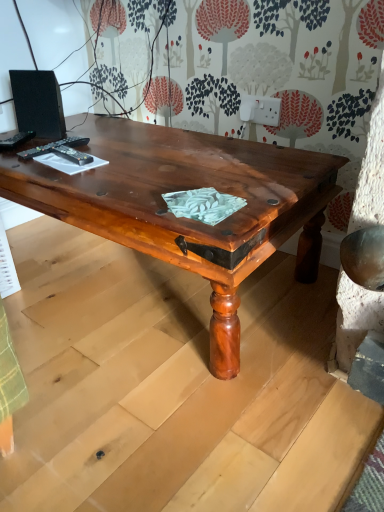
What is the approximate width of black plastic remote control at upper left, which ranks as the 2th remote control in left-to-right order?

It is 9.00 inches.

This screenshot has width=384, height=512. Find the location of `black matte speaker at upper left`. black matte speaker at upper left is located at coordinates (38, 103).

Identify the location of black plastic remote control at upper left, positioned as the 1th remote control in right-to-left order. Image resolution: width=384 pixels, height=512 pixels. (72, 155).

Is black plastic remote control at upper left, the first remote control in the left-to-right sequence, positioned beyond the bounds of black plastic remote control at upper left, the 3th remote control viewed from the left?

Yes, black plastic remote control at upper left, the first remote control in the left-to-right sequence, is located beyond the bounds of black plastic remote control at upper left, the 3th remote control viewed from the left.

Does black plastic remote control at upper left, acting as the third remote control starting from the right, come behind black plastic remote control at upper left, positioned as the 1th remote control in right-to-left order?

Yes, black plastic remote control at upper left, acting as the third remote control starting from the right, is behind black plastic remote control at upper left, positioned as the 1th remote control in right-to-left order.

Who is smaller, black plastic remote control at upper left, the first remote control in the left-to-right sequence, or black plastic remote control at upper left, the 3th remote control viewed from the left?

Smaller between the two is black plastic remote control at upper left, the first remote control in the left-to-right sequence.

From the image's perspective, is black plastic remote control at upper left, the first remote control in the left-to-right sequence, located above or below black plastic remote control at upper left, positioned as the 1th remote control in right-to-left order?

Based on their image positions, black plastic remote control at upper left, the first remote control in the left-to-right sequence, is located above black plastic remote control at upper left, positioned as the 1th remote control in right-to-left order.

Who is bigger, shiny brown wood coffee table at center or black plastic remote control at upper left, positioned as the 1th remote control in right-to-left order?

shiny brown wood coffee table at center.

Is shiny brown wood coffee table at center next to black plastic remote control at upper left, positioned as the 1th remote control in right-to-left order?

No, shiny brown wood coffee table at center is not with black plastic remote control at upper left, positioned as the 1th remote control in right-to-left order.

How many degrees apart are the facing directions of shiny brown wood coffee table at center and black plastic remote control at upper left, the 3th remote control viewed from the left?

shiny brown wood coffee table at center and black plastic remote control at upper left, the 3th remote control viewed from the left, are facing 80.2 degrees away from each other.

Locate an element on the screen. This screenshot has height=512, width=384. coffee table on the right side of black plastic remote control at upper left, the 3th remote control viewed from the left is located at coordinates (185, 218).

Are black matte speaker at upper left and black plastic remote control at upper left, the 3th remote control viewed from the left, beside each other?

black matte speaker at upper left is not next to black plastic remote control at upper left, the 3th remote control viewed from the left, and they're not touching.

Considering the positions of objects black matte speaker at upper left and black plastic remote control at upper left, positioned as the 1th remote control in right-to-left order, in the image provided, who is behind, black matte speaker at upper left or black plastic remote control at upper left, positioned as the 1th remote control in right-to-left order,?

black matte speaker at upper left.

Is black matte speaker at upper left at the right side of black plastic remote control at upper left, positioned as the 1th remote control in right-to-left order?

No.

Does point (63, 133) lie in front of point (85, 163)?

No, (63, 133) is further to viewer.

From the picture: Between black plastic remote control at upper left, the first remote control in the left-to-right sequence, and black plastic remote control at upper left, which ranks as the 2th remote control in left-to-right order, which one appears on the left side from the viewer's perspective?

black plastic remote control at upper left, the first remote control in the left-to-right sequence.

Does black plastic remote control at upper left, acting as the third remote control starting from the right, have a smaller size compared to black plastic remote control at upper left, the second remote control in the right-to-left sequence?

Yes.

In the scene shown: Could you tell me if black plastic remote control at upper left, the first remote control in the left-to-right sequence, is turned towards black plastic remote control at upper left, which ranks as the 2th remote control in left-to-right order?

No, black plastic remote control at upper left, the first remote control in the left-to-right sequence, is not oriented towards black plastic remote control at upper left, which ranks as the 2th remote control in left-to-right order.

Is black plastic remote control at upper left, the first remote control in the left-to-right sequence, not near black plastic remote control at upper left, which ranks as the 2th remote control in left-to-right order?

No, black plastic remote control at upper left, the first remote control in the left-to-right sequence, is not far away from black plastic remote control at upper left, which ranks as the 2th remote control in left-to-right order.

How many degrees apart are the facing directions of black plastic remote control at upper left, the second remote control in the right-to-left sequence, and black plastic remote control at upper left, the 3th remote control viewed from the left?

88.8 degrees separate the facing orientations of black plastic remote control at upper left, the second remote control in the right-to-left sequence, and black plastic remote control at upper left, the 3th remote control viewed from the left.

Is black plastic remote control at upper left, which ranks as the 2th remote control in left-to-right order, touching black plastic remote control at upper left, positioned as the 1th remote control in right-to-left order?

Indeed, black plastic remote control at upper left, which ranks as the 2th remote control in left-to-right order, and black plastic remote control at upper left, positioned as the 1th remote control in right-to-left order, are beside each other and touching.

Does black plastic remote control at upper left, the second remote control in the right-to-left sequence, appear on the left side of black plastic remote control at upper left, positioned as the 1th remote control in right-to-left order?

Indeed, black plastic remote control at upper left, the second remote control in the right-to-left sequence, is positioned on the left side of black plastic remote control at upper left, positioned as the 1th remote control in right-to-left order.

Is black plastic remote control at upper left, which ranks as the 2th remote control in left-to-right order, wider than black plastic remote control at upper left, positioned as the 1th remote control in right-to-left order?

Indeed, black plastic remote control at upper left, which ranks as the 2th remote control in left-to-right order, has a greater width compared to black plastic remote control at upper left, positioned as the 1th remote control in right-to-left order.

Does black plastic remote control at upper left, positioned as the 1th remote control in right-to-left order, have a larger size compared to shiny brown wood coffee table at center?

No.

From a real-world perspective, which is physically above, black plastic remote control at upper left, the 3th remote control viewed from the left, or shiny brown wood coffee table at center?

black plastic remote control at upper left, the 3th remote control viewed from the left, is physically above.

How different are the orientations of black plastic remote control at upper left, the 3th remote control viewed from the left, and shiny brown wood coffee table at center in degrees?

black plastic remote control at upper left, the 3th remote control viewed from the left, and shiny brown wood coffee table at center are facing 80.2 degrees away from each other.

Are black plastic remote control at upper left, positioned as the 1th remote control in right-to-left order, and shiny brown wood coffee table at center making contact?

No, black plastic remote control at upper left, positioned as the 1th remote control in right-to-left order, is not in contact with shiny brown wood coffee table at center.

Does black plastic remote control at upper left, which ranks as the 2th remote control in left-to-right order, turn towards black plastic remote control at upper left, acting as the third remote control starting from the right?

No.

What's the angular difference between black plastic remote control at upper left, which ranks as the 2th remote control in left-to-right order, and black plastic remote control at upper left, acting as the third remote control starting from the right,'s facing directions?

The facing directions of black plastic remote control at upper left, which ranks as the 2th remote control in left-to-right order, and black plastic remote control at upper left, acting as the third remote control starting from the right, are 36.6 degrees apart.

Considering the relative sizes of black plastic remote control at upper left, which ranks as the 2th remote control in left-to-right order, and black plastic remote control at upper left, the first remote control in the left-to-right sequence, in the image provided, is black plastic remote control at upper left, which ranks as the 2th remote control in left-to-right order, taller than black plastic remote control at upper left, the first remote control in the left-to-right sequence,?

Yes, black plastic remote control at upper left, which ranks as the 2th remote control in left-to-right order, is taller than black plastic remote control at upper left, the first remote control in the left-to-right sequence.

Identify the location of remote control located above the black plastic remote control at upper left, which ranks as the 2th remote control in left-to-right order (from the image's perspective). This screenshot has height=512, width=384. (16, 140).

Locate an element on the screen. This screenshot has width=384, height=512. the 2nd remote control to the left of the black plastic remote control at upper left, positioned as the 1th remote control in right-to-left order, counting from the anchor's position is located at coordinates (16, 140).

Where is `the 1st remote control above when counting from the shiny brown wood coffee table at center (from the image's perspective)`? the 1st remote control above when counting from the shiny brown wood coffee table at center (from the image's perspective) is located at coordinates (72, 155).

Based on their spatial positions, is black plastic remote control at upper left, the 3th remote control viewed from the left, or black plastic remote control at upper left, the first remote control in the left-to-right sequence, closer to shiny brown wood coffee table at center?

black plastic remote control at upper left, the 3th remote control viewed from the left, lies closer to shiny brown wood coffee table at center than the other object.

Considering their positions, is black matte speaker at upper left positioned further to black plastic remote control at upper left, acting as the third remote control starting from the right, than black plastic remote control at upper left, the 3th remote control viewed from the left?

Based on the image, black plastic remote control at upper left, the 3th remote control viewed from the left, appears to be further to black plastic remote control at upper left, acting as the third remote control starting from the right.

When comparing their distances from shiny brown wood coffee table at center, does black plastic remote control at upper left, acting as the third remote control starting from the right, or black plastic remote control at upper left, positioned as the 1th remote control in right-to-left order, seem closer?

The object closer to shiny brown wood coffee table at center is black plastic remote control at upper left, positioned as the 1th remote control in right-to-left order.

When comparing their distances from black plastic remote control at upper left, the first remote control in the left-to-right sequence, does shiny brown wood coffee table at center or black plastic remote control at upper left, positioned as the 1th remote control in right-to-left order, seem further?

shiny brown wood coffee table at center is further to black plastic remote control at upper left, the first remote control in the left-to-right sequence.

Considering their positions, is black plastic remote control at upper left, which ranks as the 2th remote control in left-to-right order, positioned closer to black plastic remote control at upper left, positioned as the 1th remote control in right-to-left order, than black plastic remote control at upper left, the first remote control in the left-to-right sequence?

black plastic remote control at upper left, which ranks as the 2th remote control in left-to-right order, is positioned closer to the anchor black plastic remote control at upper left, positioned as the 1th remote control in right-to-left order.

From the image, which object appears to be farther from black plastic remote control at upper left, positioned as the 1th remote control in right-to-left order, black plastic remote control at upper left, acting as the third remote control starting from the right, or black plastic remote control at upper left, which ranks as the 2th remote control in left-to-right order?

Among the two, black plastic remote control at upper left, acting as the third remote control starting from the right, is located further to black plastic remote control at upper left, positioned as the 1th remote control in right-to-left order.

When comparing their distances from black plastic remote control at upper left, the first remote control in the left-to-right sequence, does black plastic remote control at upper left, positioned as the 1th remote control in right-to-left order, or shiny brown wood coffee table at center seem further?

shiny brown wood coffee table at center is positioned further to the anchor black plastic remote control at upper left, the first remote control in the left-to-right sequence.

Looking at the image, which one is located further to black plastic remote control at upper left, the second remote control in the right-to-left sequence, shiny brown wood coffee table at center or black plastic remote control at upper left, acting as the third remote control starting from the right?

Based on the image, shiny brown wood coffee table at center appears to be further to black plastic remote control at upper left, the second remote control in the right-to-left sequence.

Find the location of a particular element. The height and width of the screenshot is (512, 384). speaker between black plastic remote control at upper left, the first remote control in the left-to-right sequence, and black plastic remote control at upper left, positioned as the 1th remote control in right-to-left order is located at coordinates (38, 103).

This screenshot has width=384, height=512. Identify the location of remote control positioned between shiny brown wood coffee table at center and black plastic remote control at upper left, the second remote control in the right-to-left sequence, from near to far. (72, 155).

Locate an element on the screen. remote control located between black plastic remote control at upper left, acting as the third remote control starting from the right, and black plastic remote control at upper left, positioned as the 1th remote control in right-to-left order, in the left-right direction is located at coordinates (53, 147).

Identify the location of remote control between black matte speaker at upper left and black plastic remote control at upper left, which ranks as the 2th remote control in left-to-right order, vertically. Image resolution: width=384 pixels, height=512 pixels. (x=16, y=140).